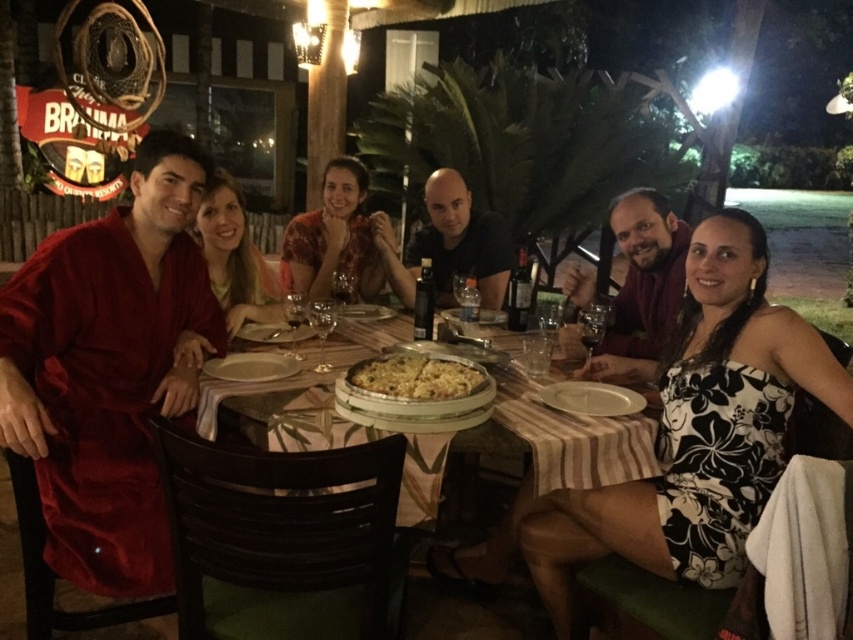
Does black matte shirt at center appear on the right side of matte red robe at lower right?

In fact, black matte shirt at center is to the left of matte red robe at lower right.

Can you confirm if black matte shirt at center is taller than matte red robe at lower right?

Yes, black matte shirt at center is taller than matte red robe at lower right.

Identify the location of black matte shirt at center. (448, 244).

Does wooden table at center have a lesser width compared to black matte shirt at center?

Incorrect, wooden table at center's width is not less than black matte shirt at center's.

Is wooden table at center behind black matte shirt at center?

No, it is in front of black matte shirt at center.

You are a GUI agent. You are given a task and a screenshot of the screen. Output one action in this format:
    pyautogui.click(x=<x>, y=<y>)
    Task: Click on the wooden table at center
    The width and height of the screenshot is (853, 640).
    Given the screenshot: What is the action you would take?
    pyautogui.click(x=561, y=440)

Does point (85, 460) lie behind point (524, 502)?

No, (85, 460) is in front of (524, 502).

Which is more to the left, velvety red robe at left or wooden table at center?

velvety red robe at left is more to the left.

Find the location of `velvety red robe at left`. velvety red robe at left is located at coordinates (103, 392).